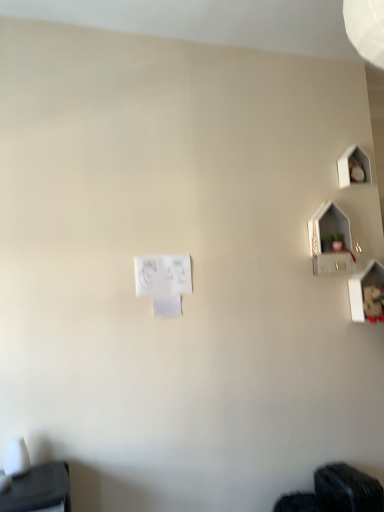
Question: Visually, is white paper at center positioned to the left or to the right of matte gray shelf at upper right?

Choices:
 (A) left
 (B) right

Answer: (A)

Question: Based on their sizes in the image, would you say white paper at center is bigger or smaller than matte gray shelf at upper right?

Choices:
 (A) small
 (B) big

Answer: (A)

Question: Considering the real-world distances, which object is farthest from the matte gray shelf at upper right?

Choices:
 (A) white paper at center
 (B) black fabric at lower right

Answer: (B)

Question: Which object is positioned farthest from the white paper at center?

Choices:
 (A) black fabric at lower right
 (B) matte gray shelf at upper right

Answer: (A)